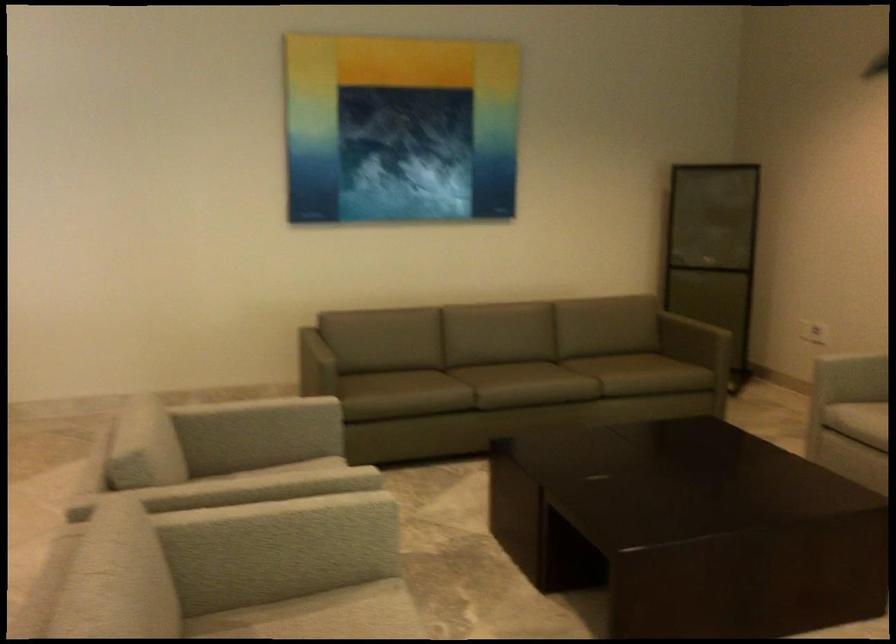
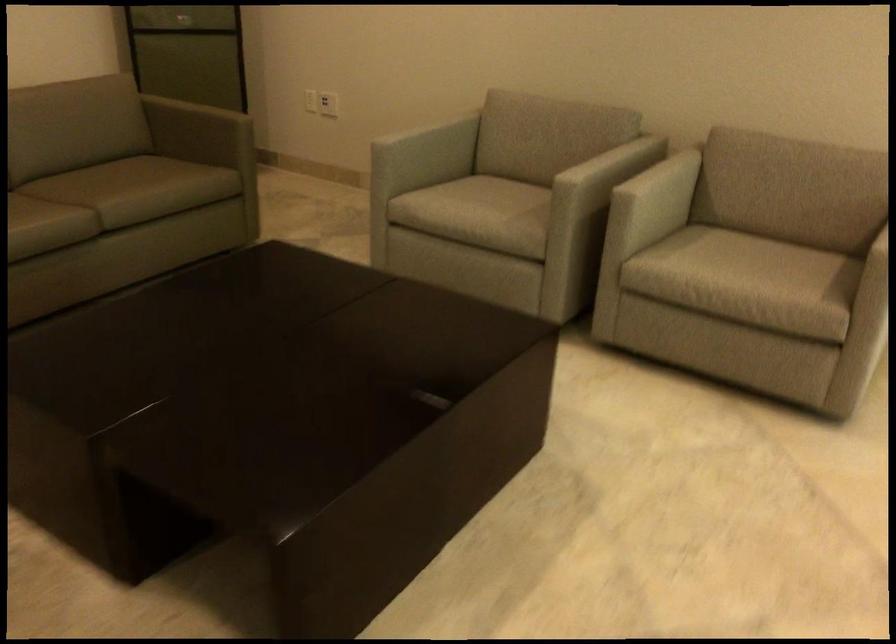
The point at (x=713, y=317) is marked in the first image. Where is the corresponding point in the second image?

(225, 93)